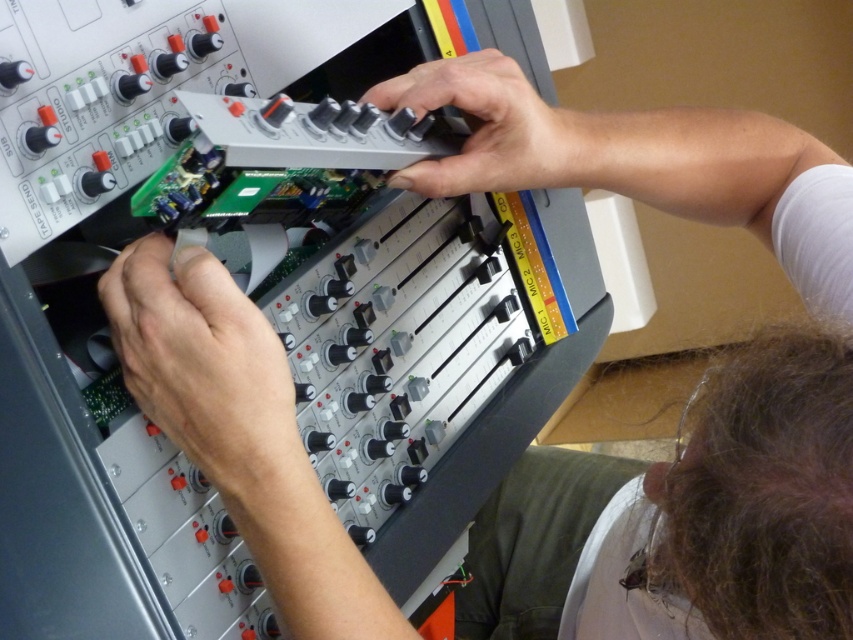
Question: Among these points, which one is farthest from the camera?

Choices:
 (A) (489, 90)
 (B) (201, 337)

Answer: (A)

Question: Observing the image, what is the correct spatial positioning of matte black circuit board at lower left in reference to metallic gray control panel at center?

Choices:
 (A) left
 (B) right

Answer: (A)

Question: Does matte black circuit board at lower left appear under metallic gray control panel at center?

Choices:
 (A) no
 (B) yes

Answer: (B)

Question: Is matte black circuit board at lower left thinner than metallic gray control panel at center?

Choices:
 (A) no
 (B) yes

Answer: (B)

Question: Among these points, which one is farthest from the camera?

Choices:
 (A) (572, 150)
 (B) (206, 314)

Answer: (A)